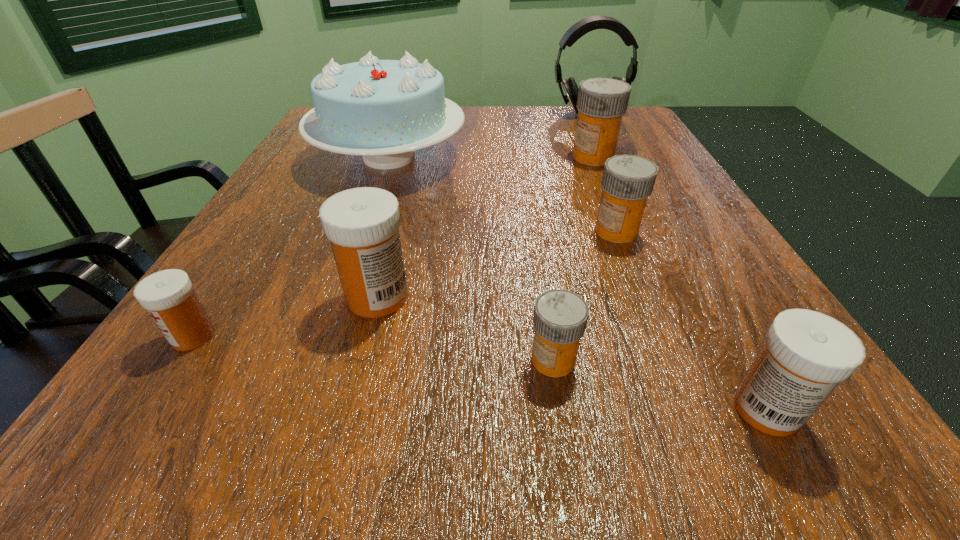
What are the coordinates of `black earphone` in the screenshot? It's located at (591, 23).

Where is `the farthest object`? Image resolution: width=960 pixels, height=540 pixels. the farthest object is located at coordinates (591, 23).

Where is `blue birthday cake`? This screenshot has height=540, width=960. blue birthday cake is located at coordinates (383, 110).

Find the location of a particular element. the farthest orange medicine is located at coordinates (602, 102).

Locate an element on the screen. This screenshot has height=540, width=960. the biggest orange medicine is located at coordinates (602, 102).

Locate an element on the screen. This screenshot has width=960, height=540. the biggest white medicine is located at coordinates (362, 224).

Where is `the fifth medicine from right to left`? The width and height of the screenshot is (960, 540). the fifth medicine from right to left is located at coordinates (362, 224).

This screenshot has width=960, height=540. In order to click on the second smallest orange medicine in this screenshot , I will do `click(628, 180)`.

This screenshot has height=540, width=960. I want to click on the second farthest medicine, so click(x=628, y=180).

The image size is (960, 540). I want to click on the nearest object, so click(x=806, y=354).